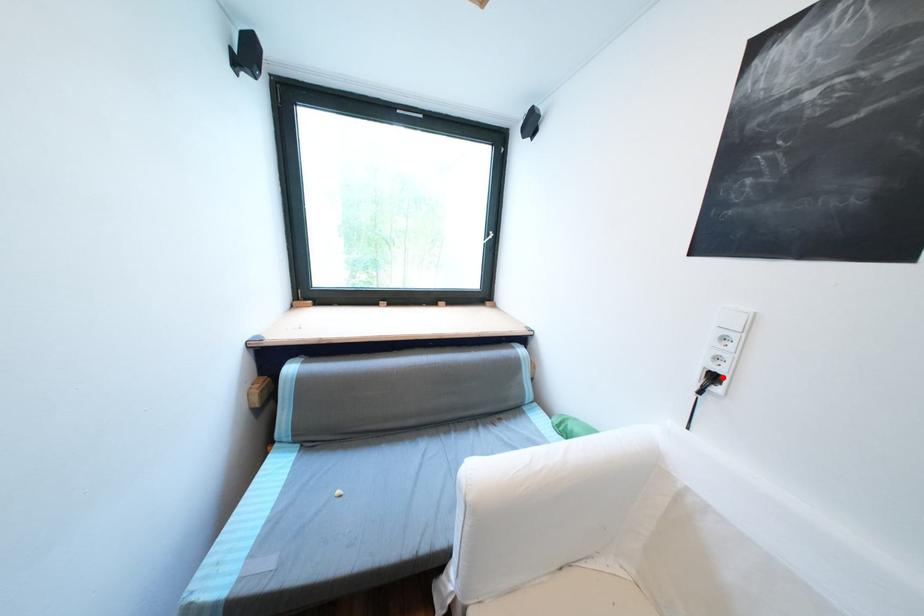
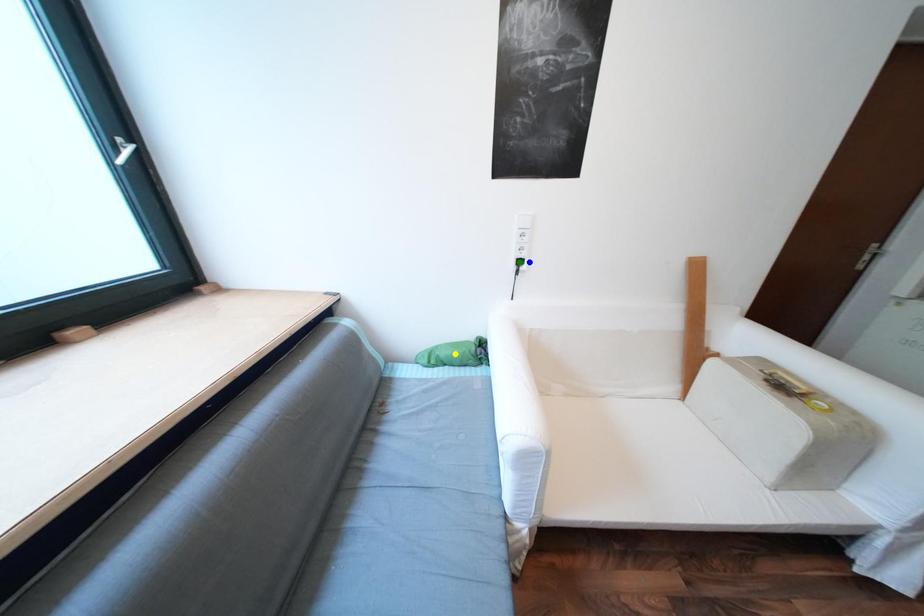
Question: I am providing you with two images of the same scene from different viewpoints. A red point is marked on the first image. You are given multiple points on the second image. Which point in image 2 is actually the same real-world point as the red point in image 1?

Choices:
 (A) green point
 (B) yellow point
 (C) blue point

Answer: (C)